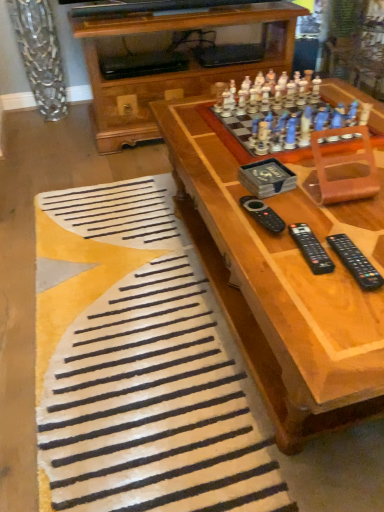
This screenshot has height=512, width=384. What do you see at coordinates (281, 113) in the screenshot?
I see `wooden chess set at upper right` at bounding box center [281, 113].

The image size is (384, 512). Identify the location of wooden chess set at center. (282, 280).

What are the coordinates of `table above the black plastic remote at lower right, which ranks as the second remote in left-to-right order (from the image's perspective)` in the screenshot? It's located at (282, 280).

Is wooden chess set at center located outside black plastic remote at lower right, acting as the 2th remote starting from the right?

Yes, wooden chess set at center is located beyond the bounds of black plastic remote at lower right, acting as the 2th remote starting from the right.

Looking at this image, is wooden chess set at center positioned with its back to black plastic remote at lower right, acting as the 2th remote starting from the right?

That's not correct — wooden chess set at center is not looking away from black plastic remote at lower right, acting as the 2th remote starting from the right.

Which object is wider, wooden chess set at center or black plastic remote at lower right, which ranks as the second remote in left-to-right order?

With larger width is wooden chess set at center.

From the image's perspective, is black plastic remote at center, arranged as the 3th remote when viewed from the right, below wooden chess set at upper right?

Yes, from the image's perspective, black plastic remote at center, arranged as the 3th remote when viewed from the right, is below wooden chess set at upper right.

From the picture: Who is more distant, black plastic remote at center, arranged as the 3th remote when viewed from the right, or wooden chess set at upper right?

wooden chess set at upper right is further from the camera.

How different are the orientations of black plastic remote at center, which is counted as the 1th remote, starting from the left, and wooden chess set at upper right in degrees?

The facing directions of black plastic remote at center, which is counted as the 1th remote, starting from the left, and wooden chess set at upper right are 176 degrees apart.

Would you say black plastic remote at center, which is counted as the 1th remote, starting from the left, is to the left or to the right of wooden chess set at upper right in the picture?

Based on their positions, black plastic remote at center, which is counted as the 1th remote, starting from the left, is located to the left of wooden chess set at upper right.

Which is behind, point (254, 198) or point (192, 128)?

Positioned behind is point (192, 128).

Considering the sizes of objects black plastic remote at center, which is counted as the 1th remote, starting from the left, and wooden chess set at center in the image provided, who is thinner, black plastic remote at center, which is counted as the 1th remote, starting from the left, or wooden chess set at center?

With smaller width is black plastic remote at center, which is counted as the 1th remote, starting from the left.

How many degrees apart are the facing directions of black plastic remote at center, which is counted as the 1th remote, starting from the left, and wooden chess set at center?

They differ by 85.7 degrees in their facing directions.

From the image's perspective, is black plastic remote at center, arranged as the 3th remote when viewed from the right, located beneath wooden chess set at center?

No, from the image's perspective, black plastic remote at center, arranged as the 3th remote when viewed from the right, is not below wooden chess set at center.

Considering the sizes of white soft rug at lower center and black plastic remote at lower right, the 3th remote viewed from the left, in the image, is white soft rug at lower center bigger or smaller than black plastic remote at lower right, the 3th remote viewed from the left,?

In the image, white soft rug at lower center appears to be larger than black plastic remote at lower right, the 3th remote viewed from the left.

Is there a large distance between white soft rug at lower center and black plastic remote at lower right, the 3th remote viewed from the left?

Actually, white soft rug at lower center and black plastic remote at lower right, the 3th remote viewed from the left, are a little close together.

Considering the positions of objects white soft rug at lower center and black plastic remote at lower right, which appears as the first remote when viewed from the right, in the image provided, who is behind, white soft rug at lower center or black plastic remote at lower right, which appears as the first remote when viewed from the right,?

Positioned behind is black plastic remote at lower right, which appears as the first remote when viewed from the right.

From a real-world perspective, is black plastic remote at lower right, which appears as the first remote when viewed from the right, positioned under black plastic remote at center, arranged as the 3th remote when viewed from the right, based on gravity?

Yes, from a real-world perspective, black plastic remote at lower right, which appears as the first remote when viewed from the right, is beneath black plastic remote at center, arranged as the 3th remote when viewed from the right.

Locate an element on the screen. This screenshot has height=512, width=384. remote that is the 2nd object located in front of the black plastic remote at center, which is counted as the 1th remote, starting from the left is located at coordinates (355, 262).

Choose the correct answer: Is black plastic remote at lower right, which appears as the first remote when viewed from the right, inside black plastic remote at center, which is counted as the 1th remote, starting from the left, or outside it?

black plastic remote at lower right, which appears as the first remote when viewed from the right, lies outside black plastic remote at center, which is counted as the 1th remote, starting from the left.

How different are the orientations of wooden chess set at upper right and white soft rug at lower center in degrees?

wooden chess set at upper right and white soft rug at lower center are facing 179 degrees away from each other.

Would you say wooden chess set at upper right contains white soft rug at lower center?

No, white soft rug at lower center is not a part of wooden chess set at upper right.

Looking at their sizes, would you say wooden chess set at upper right is wider or thinner than white soft rug at lower center?

wooden chess set at upper right is thinner than white soft rug at lower center.

Considering the relative positions of wooden chess set at upper right and black plastic remote at lower right, the 3th remote viewed from the left, in the image provided, is wooden chess set at upper right to the left of black plastic remote at lower right, the 3th remote viewed from the left, from the viewer's perspective?

Correct, you'll find wooden chess set at upper right to the left of black plastic remote at lower right, the 3th remote viewed from the left.

Which of these two, wooden chess set at upper right or black plastic remote at lower right, the 3th remote viewed from the left, is smaller?

Smaller between the two is black plastic remote at lower right, the 3th remote viewed from the left.

Does wooden chess set at upper right have a greater width compared to black plastic remote at lower right, the 3th remote viewed from the left?

Yes.

Between point (245, 101) and point (365, 278), which one is positioned in front?

Positioned in front is point (365, 278).

Where is `the 1st remote positioned above the wooden chess set at center (from a real-world perspective)`? This screenshot has width=384, height=512. the 1st remote positioned above the wooden chess set at center (from a real-world perspective) is located at coordinates (311, 249).

Starting from the wooden chess set at upper right, which remote is the 1st one in front? Please provide its 2D coordinates.

[(263, 214)]

From the image, which object appears to be farther from wooden chess set at upper right, wooden chess set at center or black plastic remote at lower right, acting as the 2th remote starting from the right?

Among the two, black plastic remote at lower right, acting as the 2th remote starting from the right, is located further to wooden chess set at upper right.

Estimate the real-world distances between objects in this image. Which object is closer to black plastic remote at center, arranged as the 3th remote when viewed from the right, black plastic remote at lower right, which ranks as the second remote in left-to-right order, or black plastic remote at lower right, the 3th remote viewed from the left?

Based on the image, black plastic remote at lower right, which ranks as the second remote in left-to-right order, appears to be nearer to black plastic remote at center, arranged as the 3th remote when viewed from the right.

Based on their spatial positions, is black plastic remote at lower right, which ranks as the second remote in left-to-right order, or white soft rug at lower center further from wooden chess set at upper right?

The object further to wooden chess set at upper right is white soft rug at lower center.

Which object lies nearer to the anchor point wooden chess set at upper right, black plastic remote at center, which is counted as the 1th remote, starting from the left, or white soft rug at lower center?

black plastic remote at center, which is counted as the 1th remote, starting from the left, is positioned closer to the anchor wooden chess set at upper right.

Which object lies nearer to the anchor point black plastic remote at lower right, which appears as the first remote when viewed from the right, wooden chess set at center or black plastic remote at lower right, which ranks as the second remote in left-to-right order?

black plastic remote at lower right, which ranks as the second remote in left-to-right order, is positioned closer to the anchor black plastic remote at lower right, which appears as the first remote when viewed from the right.

From the image, which object appears to be nearer to wooden chess set at center, white soft rug at lower center or wooden chess set at upper right?

Among the two, wooden chess set at upper right is located nearer to wooden chess set at center.

Which object lies further to the anchor point wooden chess set at center, wooden chess set at upper right or white soft rug at lower center?

white soft rug at lower center lies further to wooden chess set at center than the other object.

Estimate the real-world distances between objects in this image. Which object is further from black plastic remote at center, arranged as the 3th remote when viewed from the right, black plastic remote at lower right, the 3th remote viewed from the left, or black plastic remote at lower right, acting as the 2th remote starting from the right?

The object further to black plastic remote at center, arranged as the 3th remote when viewed from the right, is black plastic remote at lower right, the 3th remote viewed from the left.

Image resolution: width=384 pixels, height=512 pixels. What are the coordinates of `table between wooden chess set at upper right and white soft rug at lower center vertically` in the screenshot? It's located at (282, 280).

Identify the location of remote between wooden chess set at center and black plastic remote at lower right, which ranks as the second remote in left-to-right order, in the front-back direction. (355, 262).

This screenshot has height=512, width=384. Identify the location of remote between wooden chess set at upper right and black plastic remote at lower right, acting as the 2th remote starting from the right, in the up-down direction. (263, 214).

Find the location of `remote between white soft rug at lower center and black plastic remote at lower right, acting as the 2th remote starting from the right, in the horizontal direction`. remote between white soft rug at lower center and black plastic remote at lower right, acting as the 2th remote starting from the right, in the horizontal direction is located at coordinates (263, 214).